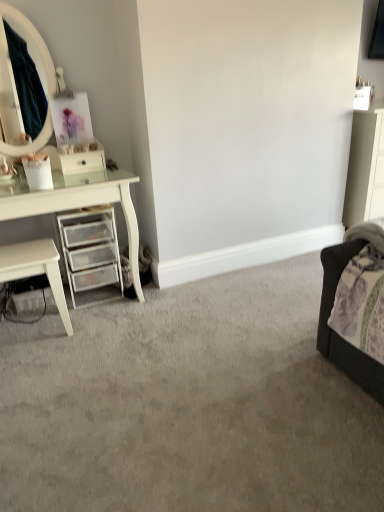
Question: Can you confirm if white glossy drawer at left is smaller than white glossy nightstand at left?

Choices:
 (A) no
 (B) yes

Answer: (B)

Question: From the image's perspective, is white glossy drawer at left above white glossy nightstand at left?

Choices:
 (A) yes
 (B) no

Answer: (A)

Question: From a real-world perspective, is white glossy drawer at left positioned over white glossy nightstand at left based on gravity?

Choices:
 (A) yes
 (B) no

Answer: (A)

Question: Does white glossy drawer at left have a lesser width compared to white glossy nightstand at left?

Choices:
 (A) no
 (B) yes

Answer: (B)

Question: From a real-world perspective, is white glossy drawer at left positioned under white glossy nightstand at left based on gravity?

Choices:
 (A) yes
 (B) no

Answer: (B)

Question: In terms of width, does white glossy nightstand at left look wider or thinner when compared to clear plastic drawers at left?

Choices:
 (A) wide
 (B) thin

Answer: (B)

Question: From a real-world perspective, is white glossy nightstand at left physically located above or below clear plastic drawers at left?

Choices:
 (A) below
 (B) above

Answer: (A)

Question: Is point (8, 252) closer or farther from the camera than point (74, 220)?

Choices:
 (A) closer
 (B) farther

Answer: (A)

Question: From their relative heights in the image, would you say white glossy nightstand at left is taller or shorter than clear plastic drawers at left?

Choices:
 (A) tall
 (B) short

Answer: (B)

Question: Considering the positions of clear plastic drawers at left and white glossy drawer at left in the image, is clear plastic drawers at left wider or thinner than white glossy drawer at left?

Choices:
 (A) wide
 (B) thin

Answer: (A)

Question: From a real-world perspective, relative to white glossy drawer at left, is clear plastic drawers at left vertically above or below?

Choices:
 (A) below
 (B) above

Answer: (A)

Question: In terms of height, does clear plastic drawers at left look taller or shorter compared to white glossy drawer at left?

Choices:
 (A) short
 (B) tall

Answer: (B)

Question: Is point pyautogui.click(x=107, y=274) closer or farther from the camera than point pyautogui.click(x=99, y=159)?

Choices:
 (A) farther
 (B) closer

Answer: (B)

Question: Is clear plastic drawers at left wider or thinner than white glossy nightstand at left?

Choices:
 (A) wide
 (B) thin

Answer: (A)

Question: In the image, is clear plastic drawers at left positioned in front of or behind white glossy nightstand at left?

Choices:
 (A) front
 (B) behind

Answer: (B)